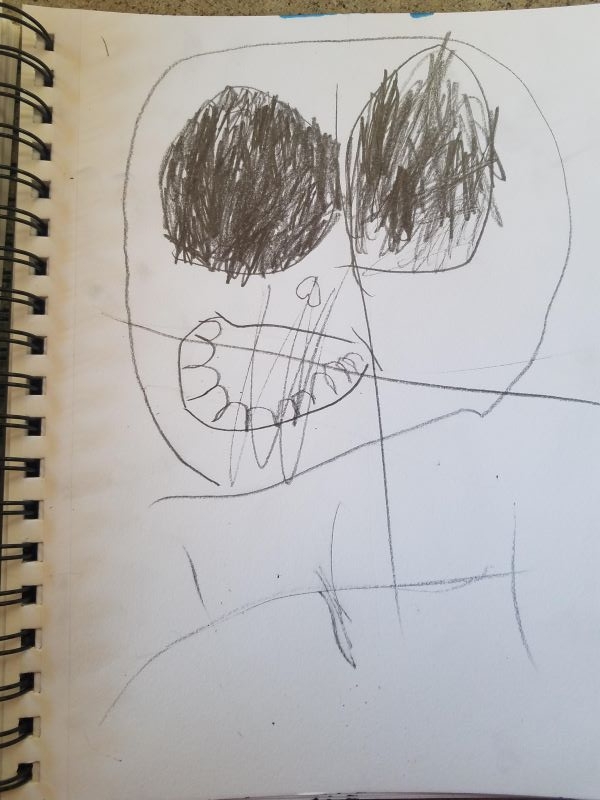
The width and height of the screenshot is (600, 800). Find the location of `binder`. binder is located at coordinates (30, 429).